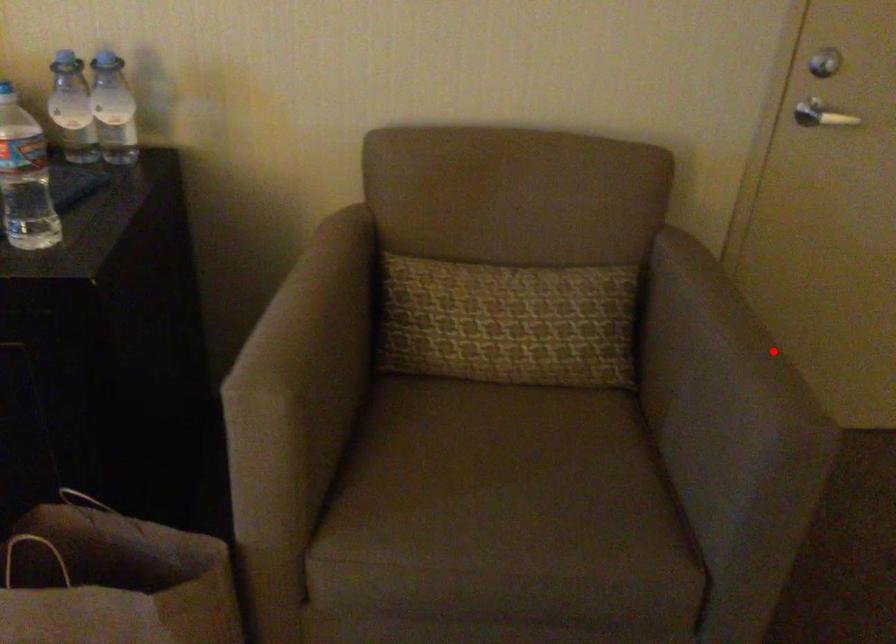
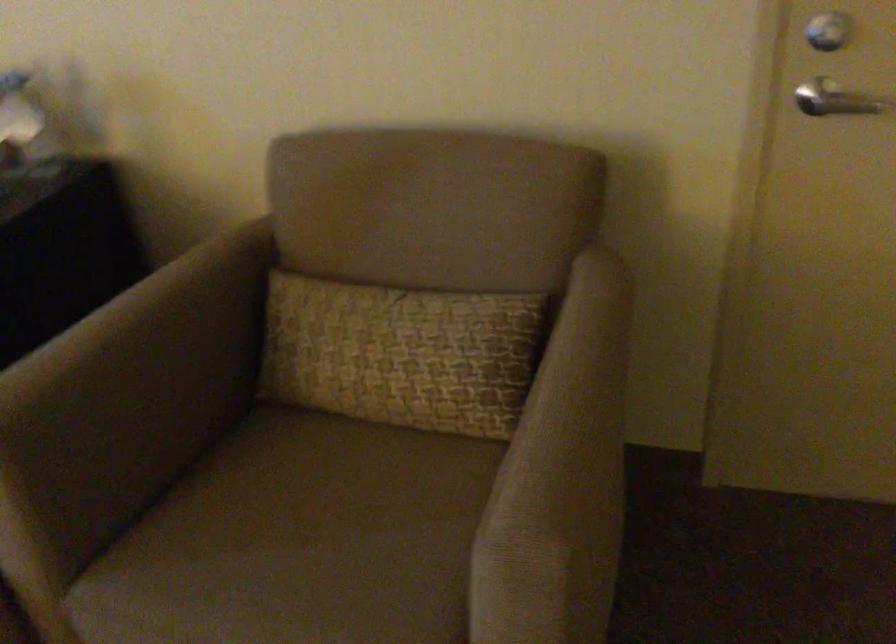
Question: I am providing you with two images of the same scene from different viewpoints. In image1, a red point is highlighted. Considering the same 3D point in image2, which of the following is correct?

Choices:
 (A) It is closer
 (B) It is farther

Answer: (A)